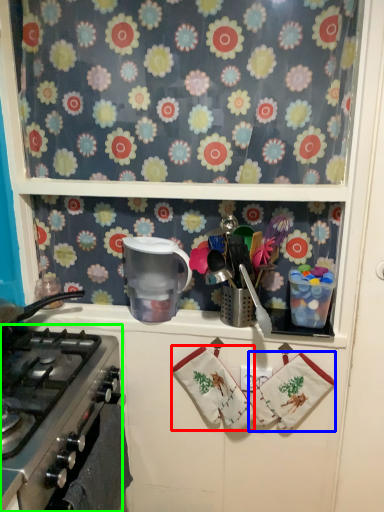
Question: Which is farther away from hand towel (highlighted by a red box)? hand towel (highlighted by a blue box) or gas stove (highlighted by a green box)?

Choices:
 (A) hand towel
 (B) gas stove

Answer: (B)